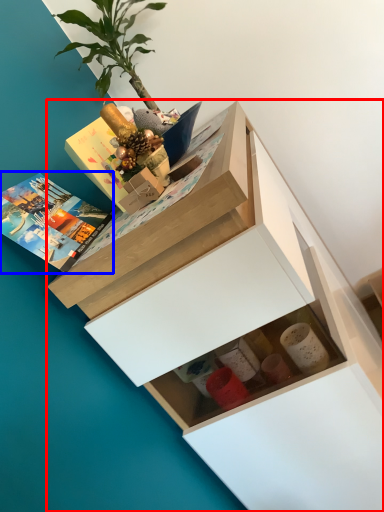
Question: Which point is further to the camera, chest of drawers (highlighted by a red box) or book (highlighted by a blue box)?

Choices:
 (A) chest of drawers
 (B) book

Answer: (B)